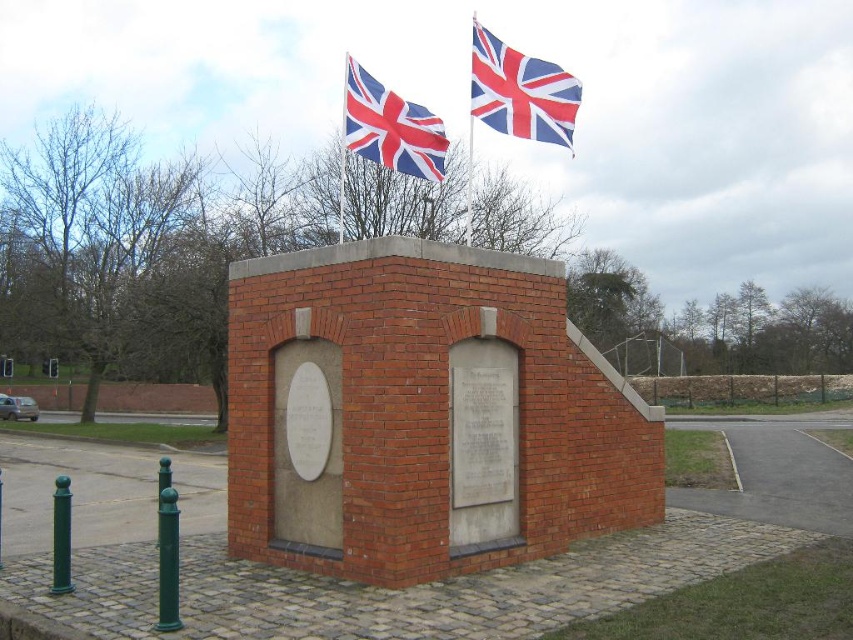
You are a flag installer who needs to ensure the distance between the two flags on the monument is at least 2.5 meters. Can you confirm if the distance between the matte fabric flag at upper center and the red and white fabric flag at upper center meets the requirement?

The matte fabric flag at upper center is 2.62 meters from the red and white fabric flag at upper center, so yes, the distance meets the requirement as it exceeds the minimum 2.5 meters requirement.

You are a visitor at the monument and notice two flags at the top. Which flag is taller between the matte fabric flag at upper center and the red and white fabric flag at upper center?

The matte fabric flag at upper center is much taller than the red and white fabric flag at upper center.